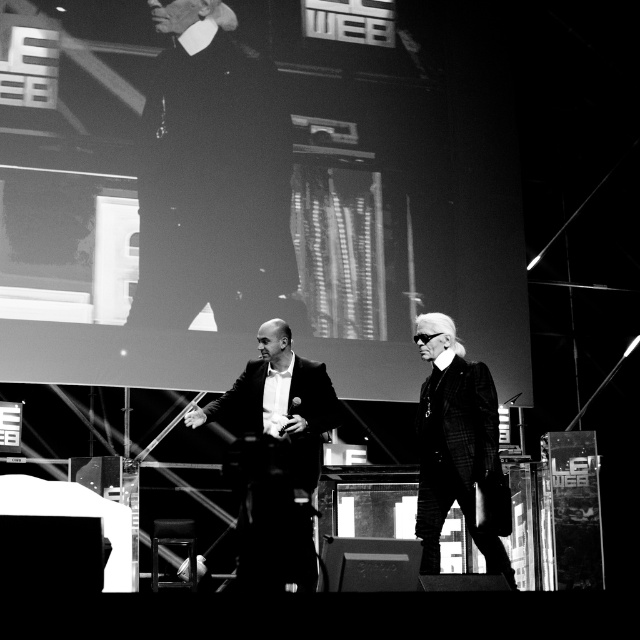
Is smooth black suit at center positioned in front of plaid wool business suit at right?

No, smooth black suit at center is further to the viewer.

Who is higher up, smooth black suit at center or plaid wool business suit at right?

smooth black suit at center is above.

Who is more distant from viewer, (285,573) or (435,545)?

The point (435,545) is behind.

The height and width of the screenshot is (640, 640). Find the location of `smooth black suit at center`. smooth black suit at center is located at coordinates (275, 458).

How much distance is there between dark velvet suit at upper left and plaid wool business suit at right?

The distance of dark velvet suit at upper left from plaid wool business suit at right is 2.19 meters.

Can you confirm if dark velvet suit at upper left is taller than plaid wool business suit at right?

Yes, dark velvet suit at upper left is taller than plaid wool business suit at right.

Between point (262, 125) and point (472, 404), which one is positioned behind?

Positioned behind is point (262, 125).

Image resolution: width=640 pixels, height=640 pixels. Find the location of `dark velvet suit at upper left`. dark velvet suit at upper left is located at coordinates (212, 180).

Which is behind, point (250, 253) or point (276, 346)?

Positioned behind is point (250, 253).

Identify the location of dark velvet suit at upper left. pyautogui.click(x=212, y=180).